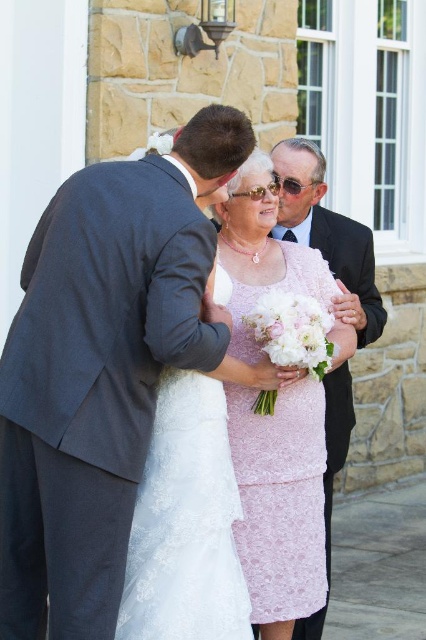
Question: Can you confirm if pink lace dress at center is bigger than matte black suit at upper center?

Choices:
 (A) no
 (B) yes

Answer: (A)

Question: Can you confirm if pink lace dress at center is positioned to the right of matte black suit at upper center?

Choices:
 (A) no
 (B) yes

Answer: (A)

Question: Is pink lace dress at center positioned behind matte black suit at upper center?

Choices:
 (A) yes
 (B) no

Answer: (B)